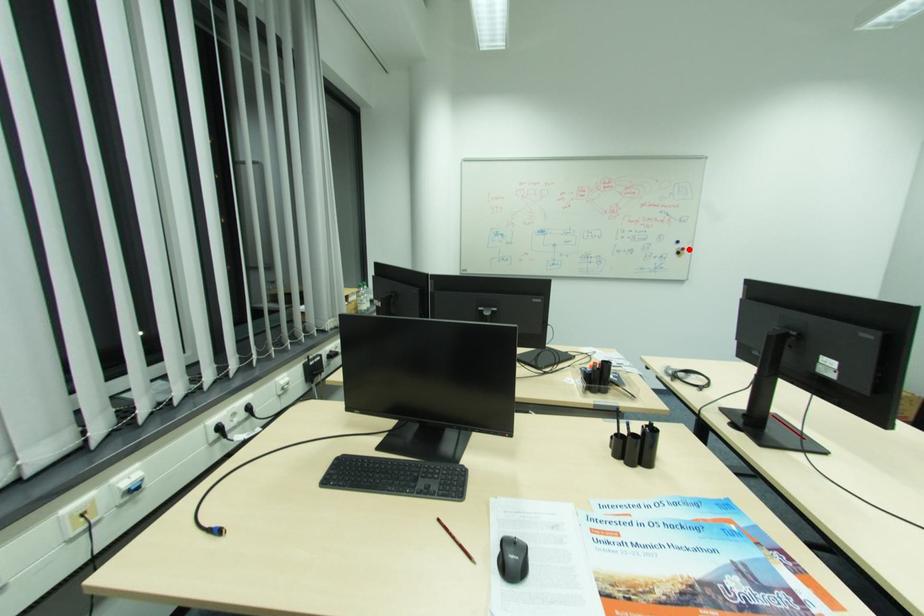
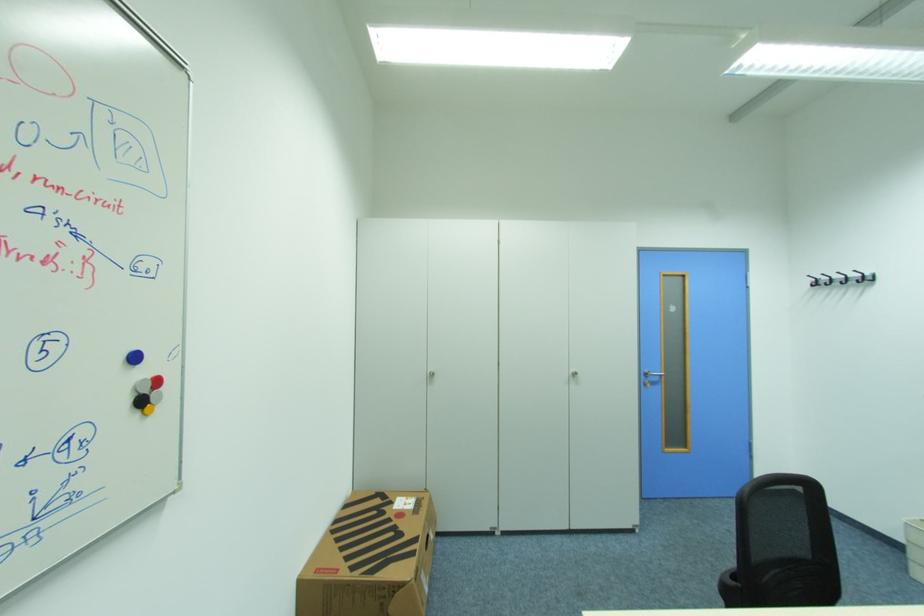
Find the pixel in the second image that matches the highlighted location in the first image.

(162, 382)